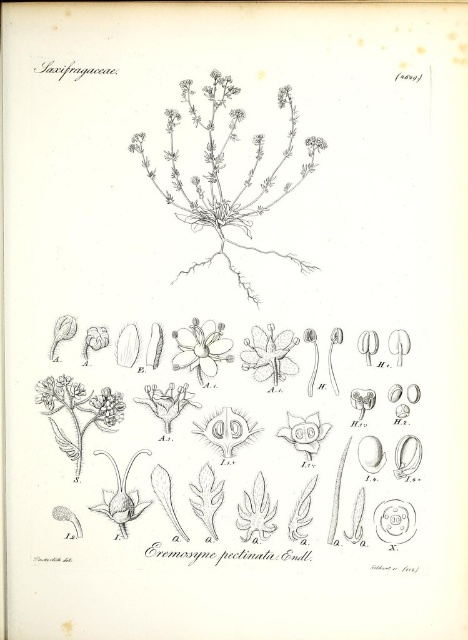
You are a botanist examining the illustration of Eremosyne pectinata. The image shows two types of flowers at the center. Which flower, the smooth white flower at center or the translucent white flower at center, is bigger in size?

The smooth white flower at center is larger in size than the translucent white flower at center.